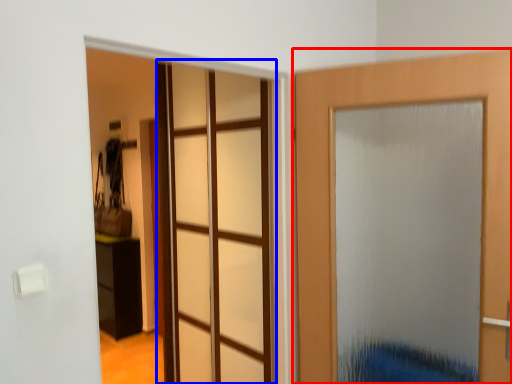
Question: Which point is closer to the camera, door (highlighted by a red box) or glass door (highlighted by a blue box)?

Choices:
 (A) door
 (B) glass door

Answer: (A)